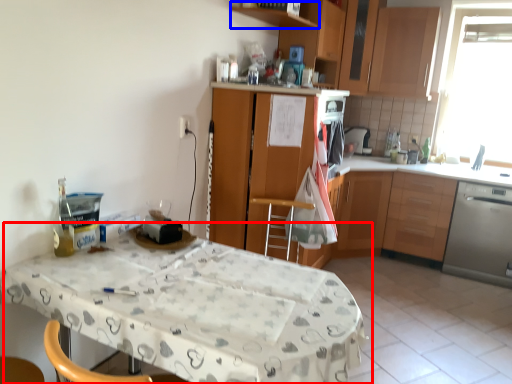
Question: Among these objects, which one is nearest to the camera, table (highlighted by a red box) or shelf (highlighted by a blue box)?

Choices:
 (A) table
 (B) shelf

Answer: (A)